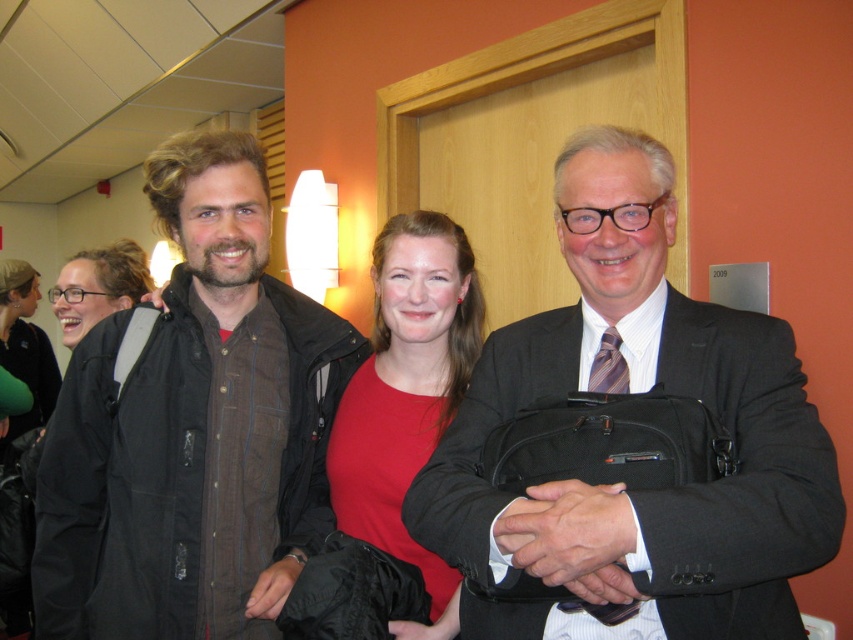
Who is more forward, (387, 406) or (265, 598)?

Point (265, 598) is more forward.

Is matte red shirt at center thinner than black leather handbag at lower center?

Incorrect, matte red shirt at center's width is not less than black leather handbag at lower center's.

Is point (438, 426) positioned behind point (267, 573)?

Yes, point (438, 426) is behind point (267, 573).

Where is `matte red shirt at center`? The image size is (853, 640). matte red shirt at center is located at coordinates (407, 396).

Between matte black suit at center and black leather handbag at lower center, which one has less height?

black leather handbag at lower center

The width and height of the screenshot is (853, 640). What do you see at coordinates (624, 481) in the screenshot? I see `matte black suit at center` at bounding box center [624, 481].

You are a GUI agent. You are given a task and a screenshot of the screen. Output one action in this format:
    pyautogui.click(x=<x>, y=<y>)
    Task: Click on the matte black suit at center
    This screenshot has width=853, height=640.
    Given the screenshot: What is the action you would take?
    pyautogui.click(x=624, y=481)

Is matte black suit at center taller than black leather handbag at center?

Correct, matte black suit at center is much taller as black leather handbag at center.

Can you confirm if matte black suit at center is shorter than black leather handbag at center?

In fact, matte black suit at center may be taller than black leather handbag at center.

Which is in front, point (448, 525) or point (570, 582)?

Point (570, 582)

Identify the location of matte black suit at center. (624, 481).